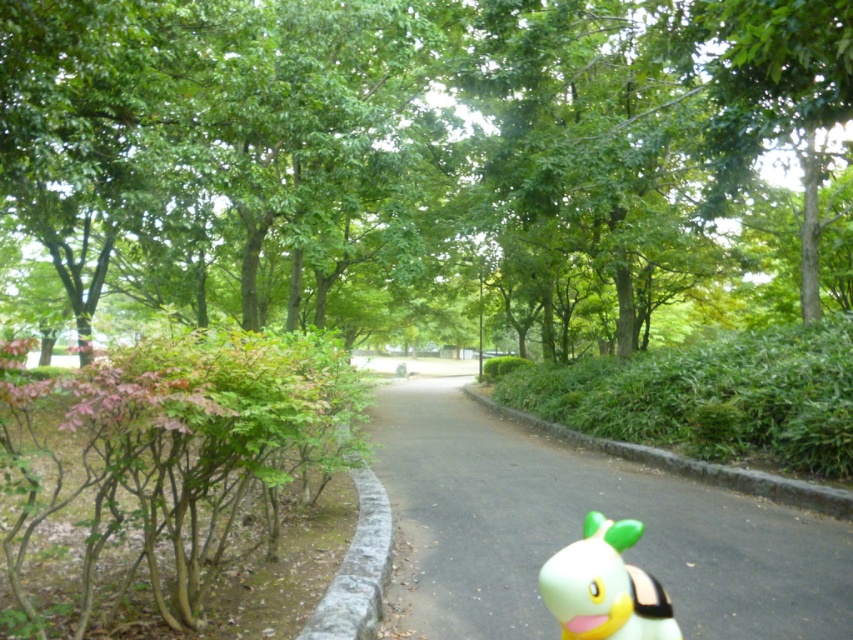
Question: Which point is farther to the camera?

Choices:
 (A) (665, 246)
 (B) (575, 593)

Answer: (A)

Question: Is black asphalt path at center positioned at the back of yellow rubber duck at lower right?

Choices:
 (A) yes
 (B) no

Answer: (A)

Question: Among these points, which one is nearest to the camera?

Choices:
 (A) (605, 572)
 (B) (428, 540)

Answer: (A)

Question: Is green leafy tree at center below black asphalt path at center?

Choices:
 (A) yes
 (B) no

Answer: (B)

Question: Among these objects, which one is nearest to the camera?

Choices:
 (A) yellow rubber duck at lower right
 (B) green leafy tree at center
 (C) black asphalt path at center

Answer: (A)

Question: Does black asphalt path at center have a smaller size compared to yellow rubber duck at lower right?

Choices:
 (A) yes
 (B) no

Answer: (B)